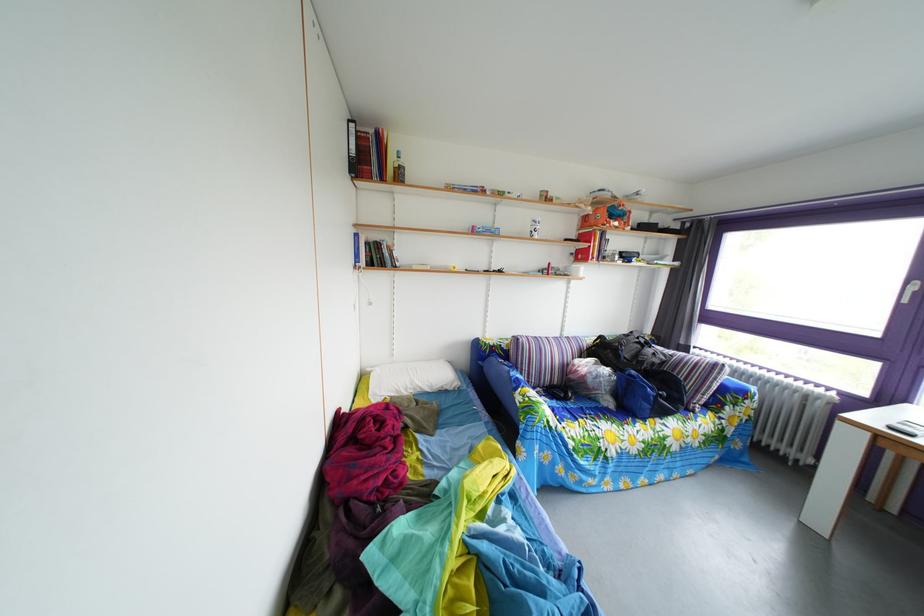
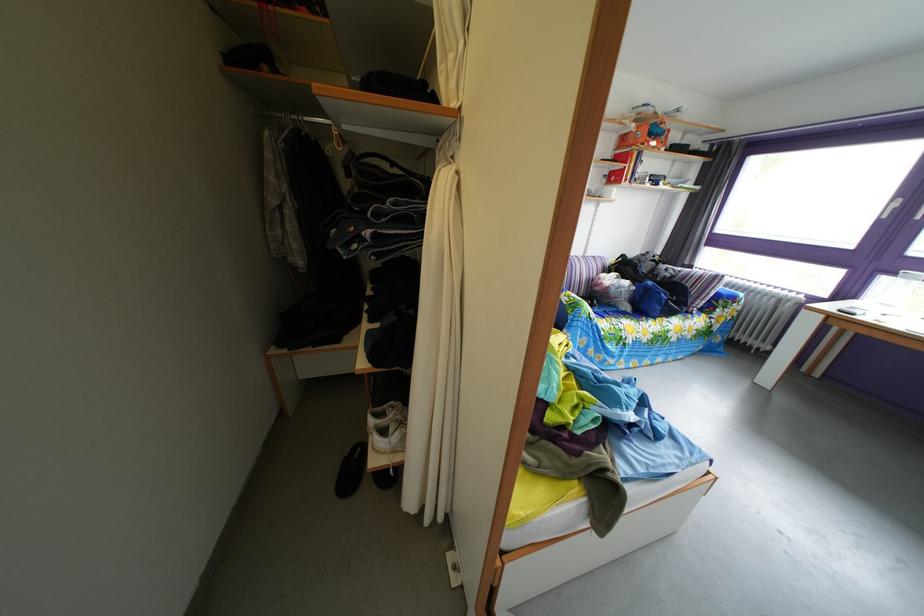
In the second image, find the point that corresponds to the point at 573,339 in the first image.

(596, 261)